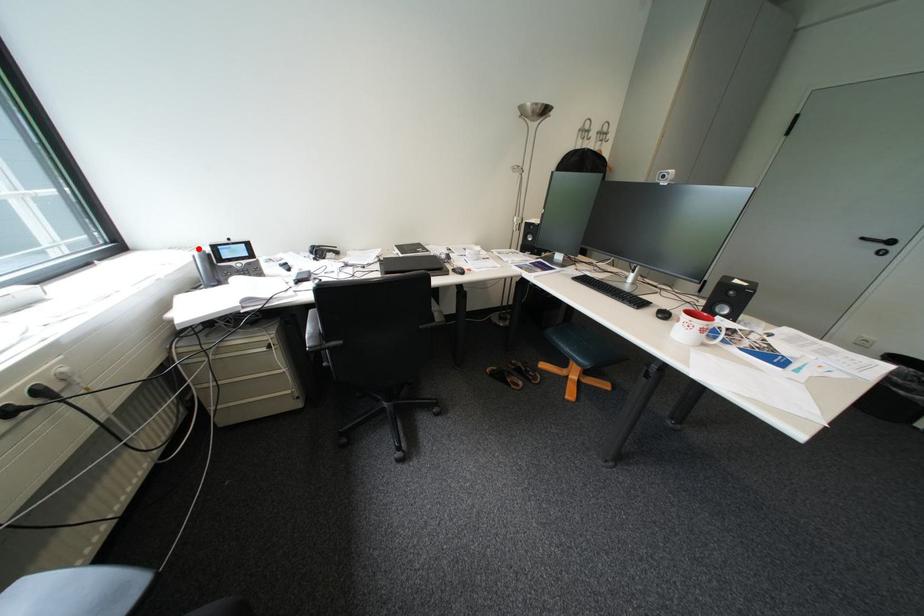
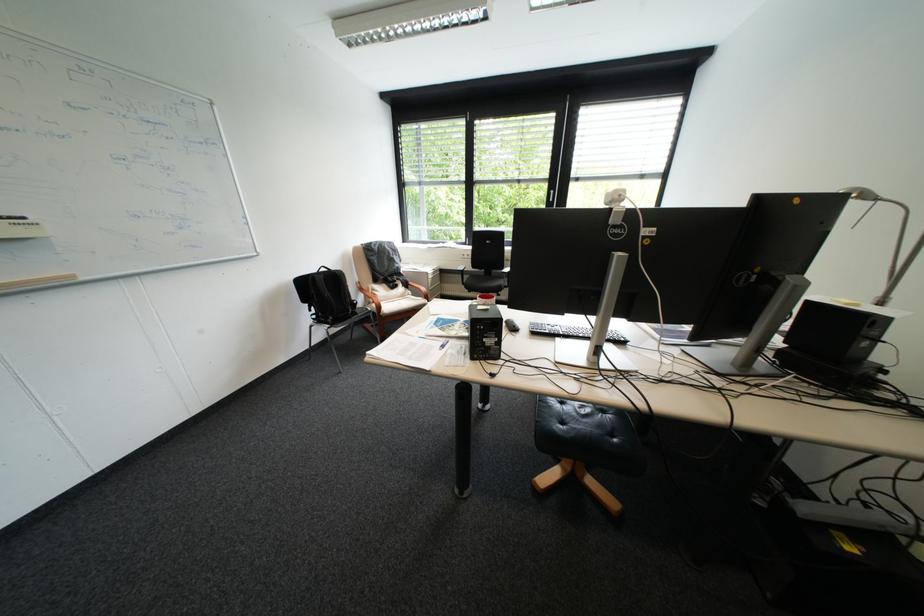
Question: I am providing you with two images of the same scene from different viewpoints. A red point is marked on the first image. Can you still see the location of the red point in image 2?

Choices:
 (A) Yes
 (B) No

Answer: (B)